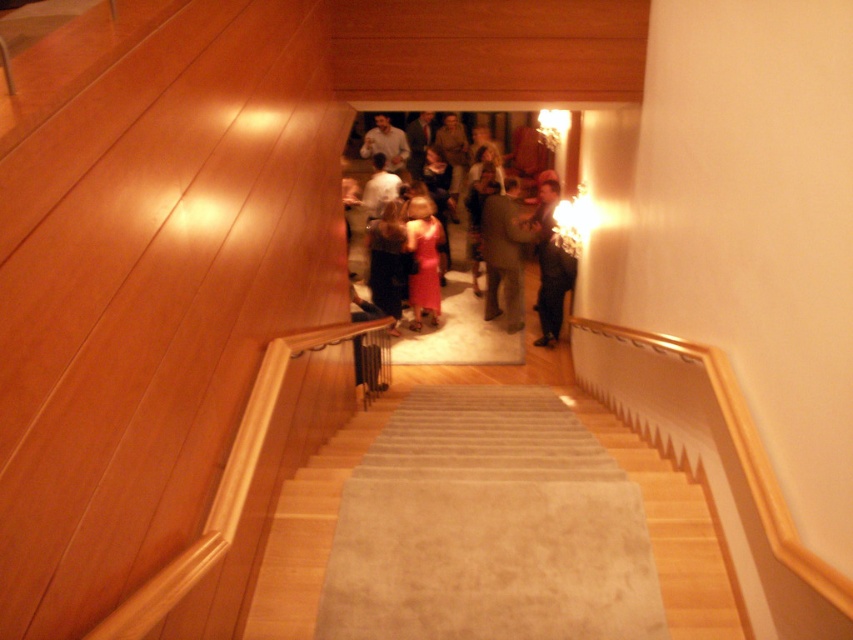
Is matte pink dress at center in front of matte brown suit at center?

No, it is behind matte brown suit at center.

Which is behind, point (361, 173) or point (511, 188)?

Point (361, 173)

This screenshot has width=853, height=640. What are the coordinates of `matte pink dress at center` in the screenshot? It's located at (363, 147).

Is point (360, 552) positioned behind point (490, 292)?

That is False.

Between beige carpeted stairs at center and matte brown suit at center, which one is positioned lower?

Positioned lower is beige carpeted stairs at center.

What do you see at coordinates (492, 536) in the screenshot? I see `beige carpeted stairs at center` at bounding box center [492, 536].

The height and width of the screenshot is (640, 853). Find the location of `beige carpeted stairs at center`. beige carpeted stairs at center is located at coordinates (492, 536).

Which is above, beige carpeted stairs at center or matte pink dress at center?

→ Positioned higher is matte pink dress at center.

Which of these two, beige carpeted stairs at center or matte pink dress at center, stands shorter?

With less height is beige carpeted stairs at center.

Where is `beige carpeted stairs at center`? beige carpeted stairs at center is located at coordinates (492, 536).